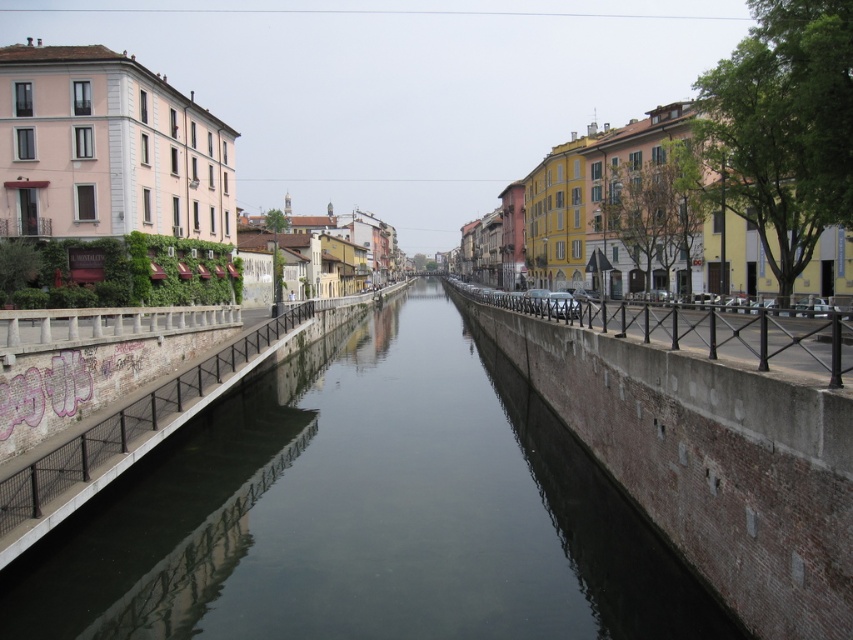
Question: Does smooth concrete canal at center have a greater width compared to black metal railing at center?

Choices:
 (A) yes
 (B) no

Answer: (A)

Question: From the image, what is the correct spatial relationship of smooth concrete canal at center in relation to concrete bridge at center?

Choices:
 (A) left
 (B) right

Answer: (B)

Question: Which point is closer to the camera?

Choices:
 (A) (454, 444)
 (B) (329, 330)

Answer: (A)

Question: From the image, what is the correct spatial relationship of black metal railing at center in relation to concrete bridge at center?

Choices:
 (A) below
 (B) above

Answer: (B)

Question: Which of the following is the farthest from the observer?

Choices:
 (A) (305, 339)
 (B) (780, 339)

Answer: (A)

Question: Which of the following is the farthest from the observer?

Choices:
 (A) black metal railing at center
 (B) smooth concrete canal at center

Answer: (B)